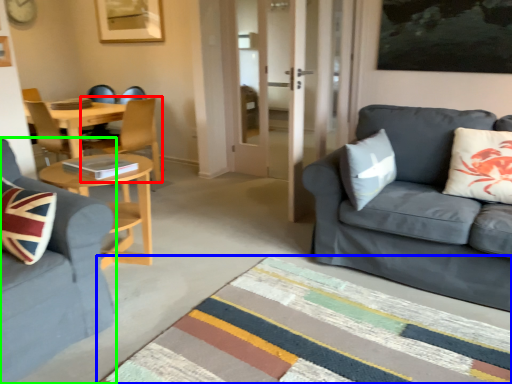
Question: Based on their relative distances, which object is nearer to chair (highlighted by a red box)? Choose from plain (highlighted by a blue box) and studio couch (highlighted by a green box).

Choices:
 (A) plain
 (B) studio couch

Answer: (B)